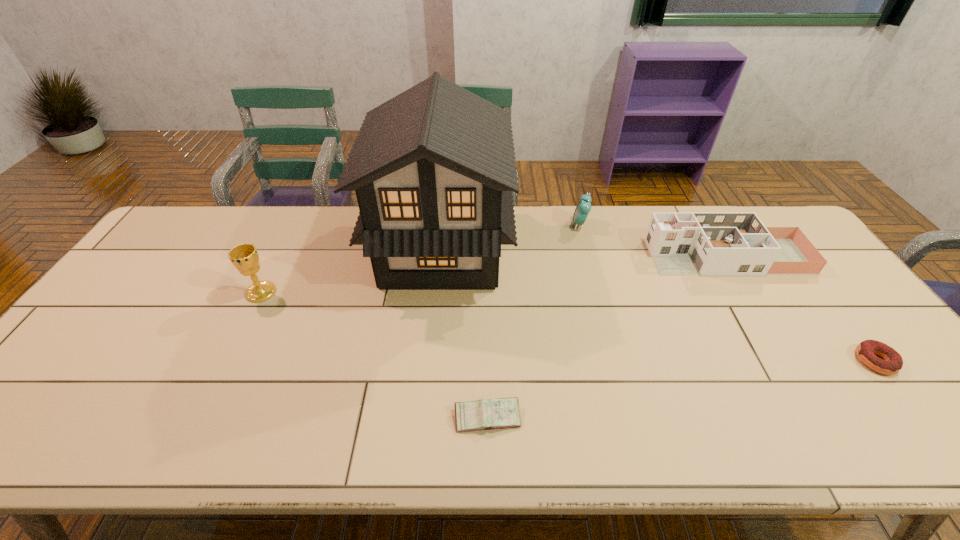
The height and width of the screenshot is (540, 960). I want to click on vacant space that satisfies the following two spatial constraints: 1. on the front-facing side of the shortest object; 2. on the left side of the left dollhouse, so click(430, 361).

Where is `free space that satisfies the following two spatial constraints: 1. at the front door of the right dollhouse; 2. on the front side of the nearest object`? The width and height of the screenshot is (960, 540). free space that satisfies the following two spatial constraints: 1. at the front door of the right dollhouse; 2. on the front side of the nearest object is located at coordinates (826, 417).